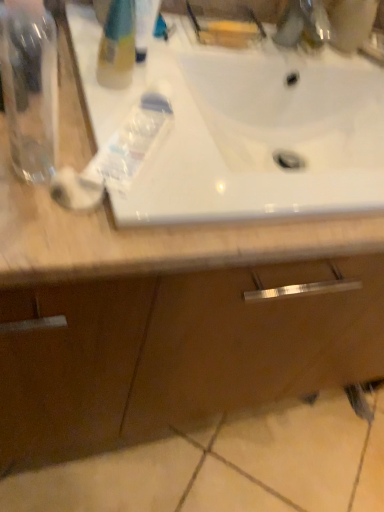
Locate an element on the screen. unoccupied region to the right of translucent plastic toothpaste at center is located at coordinates (256, 200).